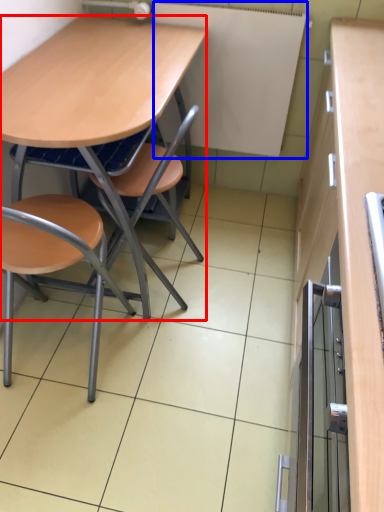
Question: Which object is further to the camera taking this photo, desk (highlighted by a red box) or bulletin board (highlighted by a blue box)?

Choices:
 (A) desk
 (B) bulletin board

Answer: (B)